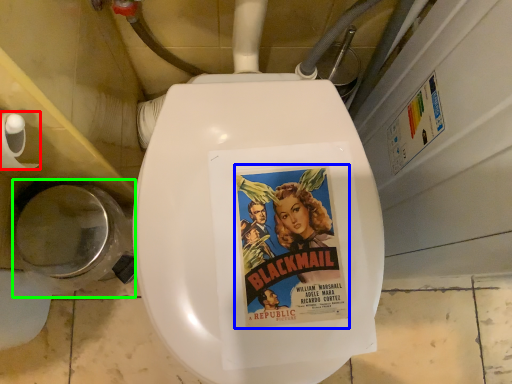
Question: Which is farther away from toilet paper (highlighted by a red box)? fiction book (highlighted by a blue box) or toilet bowl (highlighted by a green box)?

Choices:
 (A) fiction book
 (B) toilet bowl

Answer: (A)